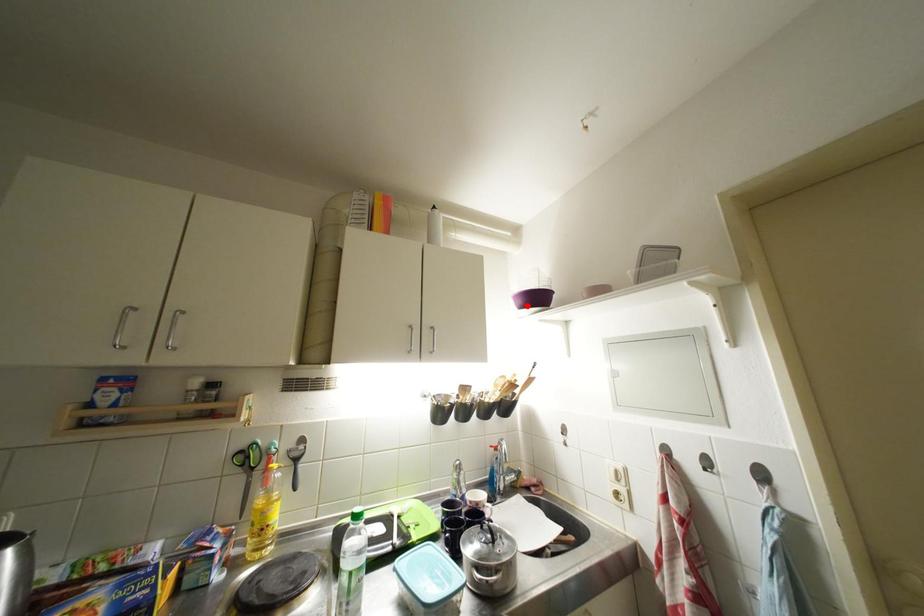
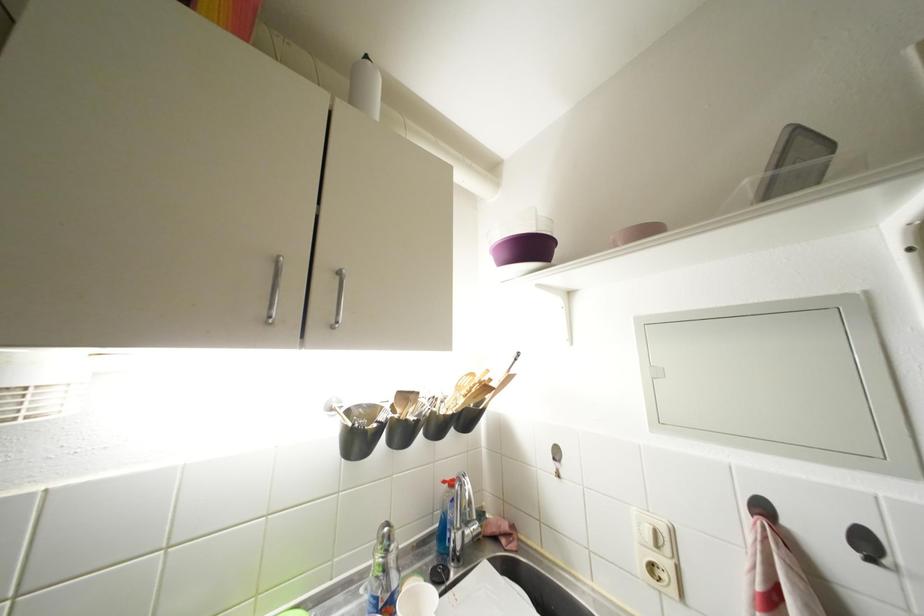
Locate, in the second image, the point that corresponds to the highlighted location in the first image.

(512, 259)